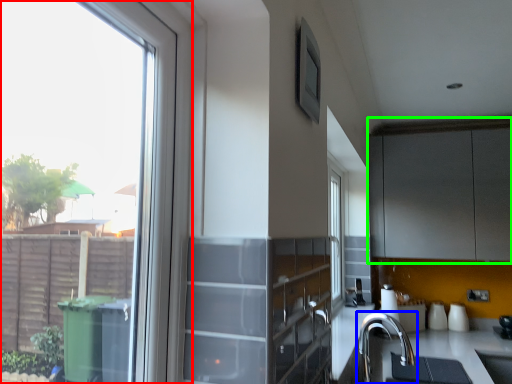
Question: Considering the real-world distances, which object is farthest from window (highlighted by a red box)? tap (highlighted by a blue box) or cabinetry (highlighted by a green box)?

Choices:
 (A) tap
 (B) cabinetry

Answer: (B)